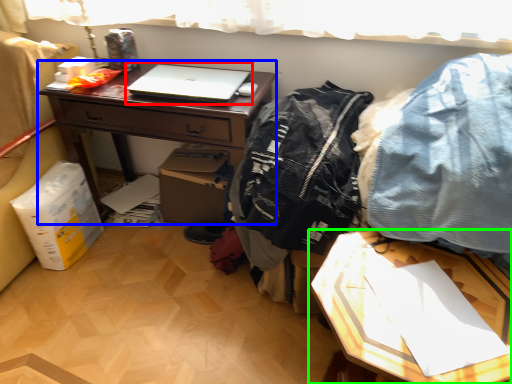
Question: Based on their relative distances, which object is nearer to laptop (highlighted by a red box)? Choose from desk (highlighted by a blue box) and table (highlighted by a green box).

Choices:
 (A) desk
 (B) table

Answer: (A)